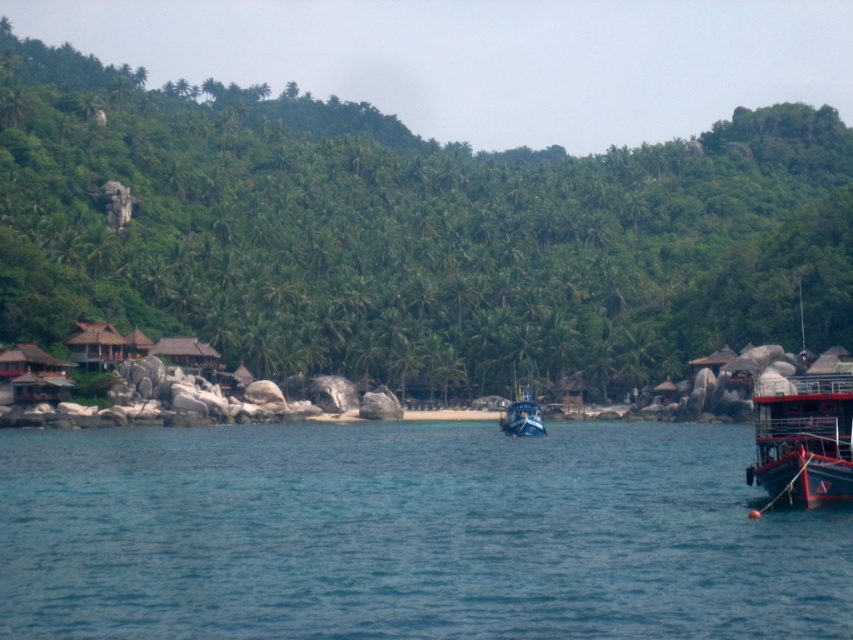
You are planning to set up a picnic area in this coastal scene. You want to ensure there is enough space between the green leafy tree at center and the red painted metal boat at right for a picnic blanket. Based on their sizes, can you determine if there is sufficient space between them?

The green leafy tree at center is wider than the red painted metal boat at right. Since the tree is wider, there might be enough space between them for a picnic blanket, but the exact distance isn

You are standing at the origin point of the coordinate system. You want to reach the blue water at center. Which direction should you move in to get there?

To reach the blue water at center, you should move in the direction of the coordinate point 0.836 on the x axis and 0.479 on the y axis.

You are standing on the beach and want to walk from the green leafy tree at center to the red painted metal boat at right. Which direction should you head towards?

Since the green leafy tree at center is closer to you than the red painted metal boat at right, you should head towards the right direction to reach the boat.